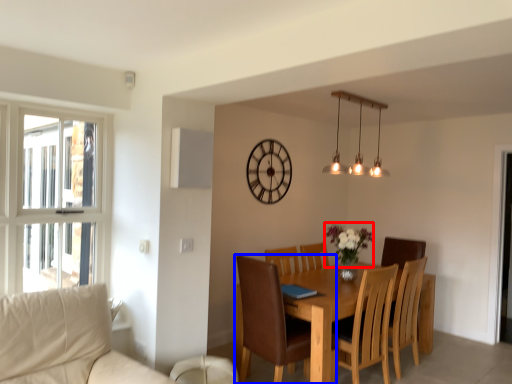
Question: Which of the following is the closest to the observer, flower (highlighted by a red box) or chair (highlighted by a blue box)?

Choices:
 (A) flower
 (B) chair

Answer: (B)